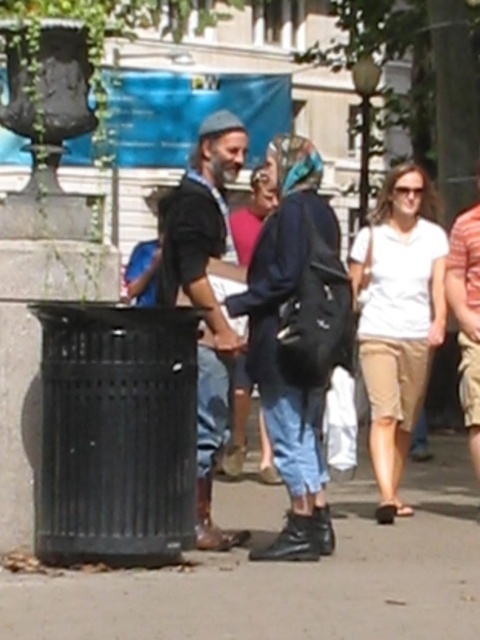
You are a photographer standing on the sidewalk and want to take a picture of the black rubber boots at lower center and the white cotton shirt at center. Which object should you focus on first if you want to capture both in the same frame without moving the camera?

The black rubber boots at lower center is below the white cotton shirt at center, so you should focus on the white cotton shirt at center first to ensure both are in the frame.

You are standing at the position of the denim jacket at center and want to take a photo of the black trash bin on the left. However, your camera has a maximum focus range of 6 meters. Can you capture a clear photo of the black trash bin on the left with your camera?

The denim jacket at center and camera are 6.61 meters apart from each other. Since the camera can only focus up to 6 meters, the distance is too far to capture a clear photo of the black trash bin on the left.